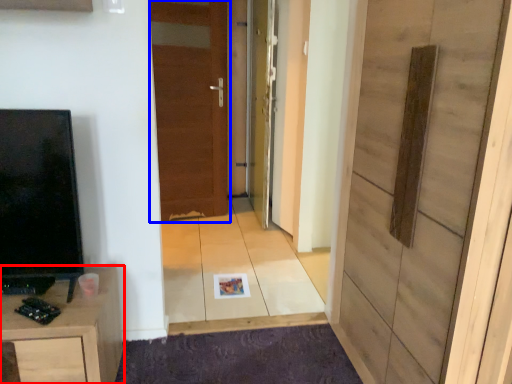
Question: Which of the following is the farthest to the observer, cabinetry (highlighted by a red box) or door (highlighted by a blue box)?

Choices:
 (A) cabinetry
 (B) door

Answer: (B)